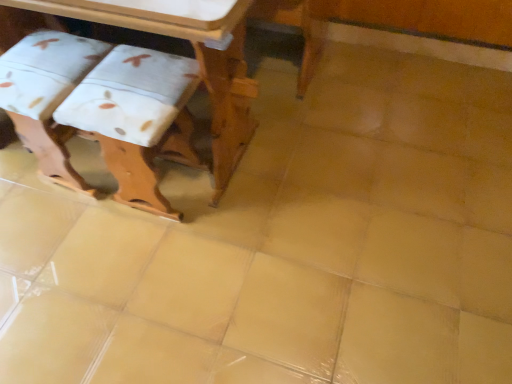
Locate an element on the screen. The height and width of the screenshot is (384, 512). vacant area situated to the left side of white fabric step stool at left, arranged as the 1th step stool when viewed from the right is located at coordinates (66, 227).